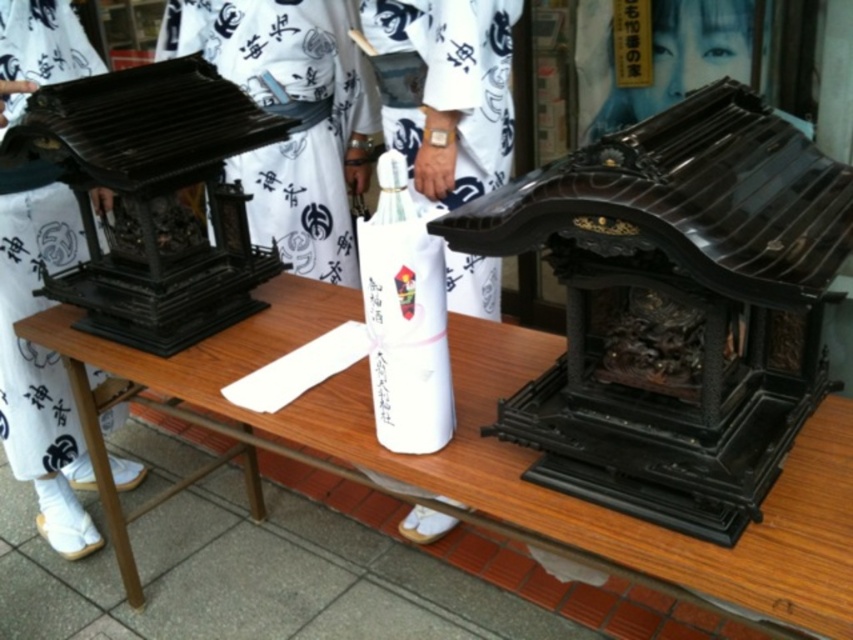
You are attending a cultural event and see the wooden table at center and the white cotton kimono at center. From your perspective, which object is closer to you?

The wooden table at center is closer to you because it is in front of the white cotton kimono at center.